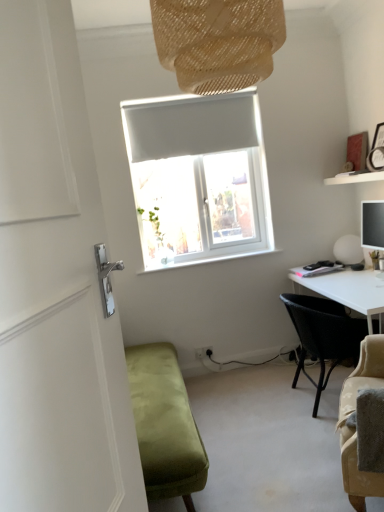
Locate an element on the screen. free space to the left of black woven chair at right is located at coordinates (250, 406).